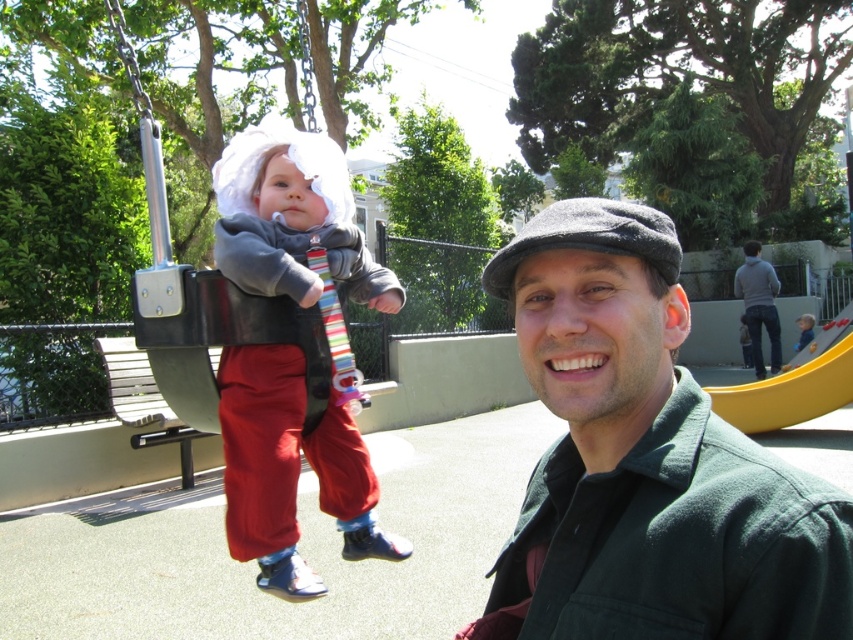
You are designing a storage box for items in the playground. The storage box must accommodate both the black plastic swing at upper left and the dark gray woolen cap at upper center. Given their sizes, which item will require more space in the storage box?

The black plastic swing at upper left requires more space in the storage box because its width is larger than that of the dark gray woolen cap at upper center.

You are trying to decide which sweater to wear for a casual day out. Both the matte gray sweater at center and the light blue knit sweater at center are options. Which one is narrower?

The matte gray sweater at center is narrower than the light blue knit sweater at center.